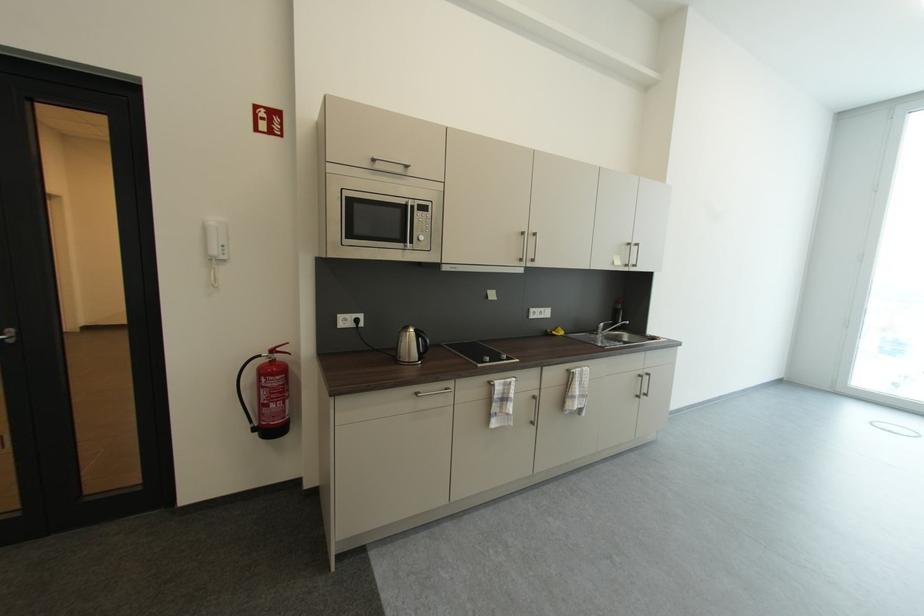
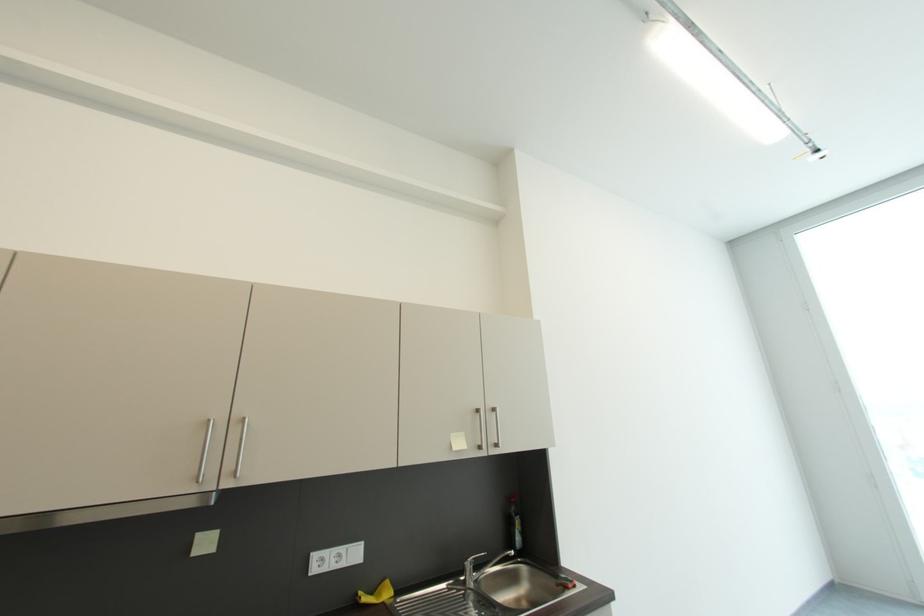
The images are taken continuously from a first-person perspective. In which direction are you moving?

The cameraman moved toward right, forward.